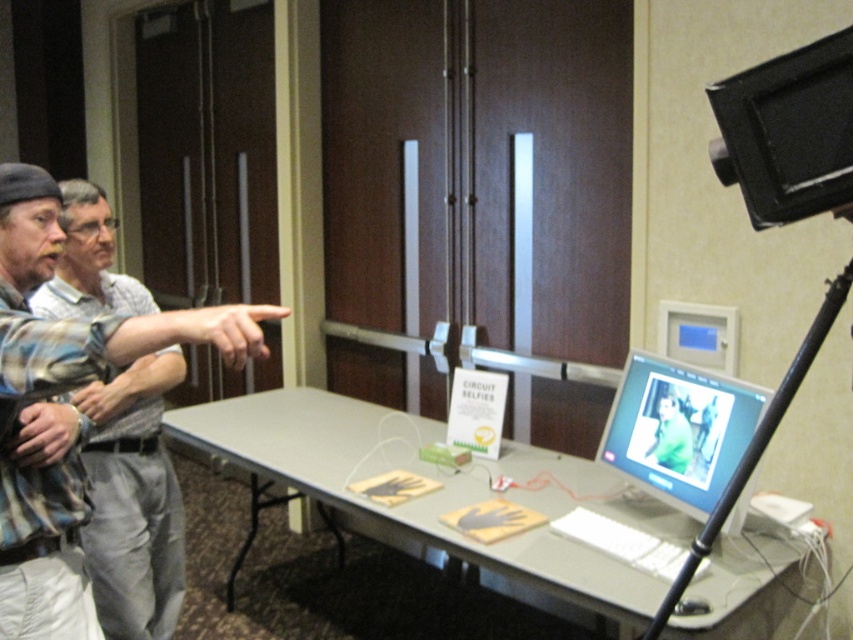
Question: Among these points, which one is farthest from the camera?

Choices:
 (A) (851, 180)
 (B) (181, 524)
 (C) (782, 401)
 (D) (596, 576)

Answer: (B)

Question: Which point is closer to the camera taking this photo?

Choices:
 (A) (849, 42)
 (B) (157, 512)
 (C) (271, 394)
 (D) (781, 388)

Answer: (A)

Question: Observing the image, what is the correct spatial positioning of black plastic video camera at upper right in reference to black metal tripod at right?

Choices:
 (A) above
 (B) below

Answer: (A)

Question: Can you confirm if gray plastic table at center is positioned below black metal tripod at right?

Choices:
 (A) yes
 (B) no

Answer: (A)

Question: Where is gray plastic table at center located in relation to black metal tripod at right in the image?

Choices:
 (A) above
 (B) below

Answer: (B)

Question: Which of these objects is positioned closest to the black metal tripod at right?

Choices:
 (A) plaid shirt at left
 (B) black plastic video camera at upper right
 (C) gray plastic table at center

Answer: (B)